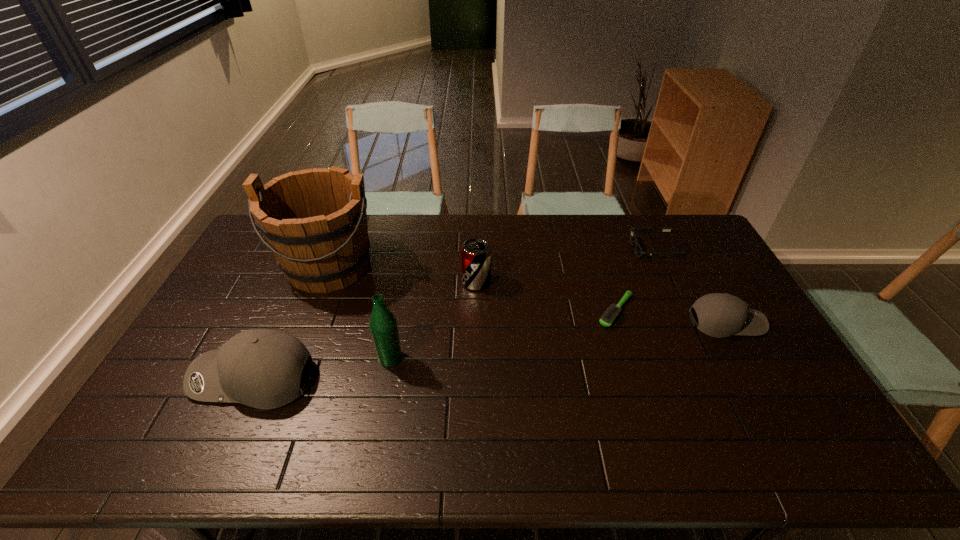
Locate an element on the screen. The image size is (960, 540). free point at the left edge is located at coordinates (217, 321).

Find the location of `free point at the right edge`. free point at the right edge is located at coordinates (722, 284).

Where is `free spot between the soda can and the tallest object`? Image resolution: width=960 pixels, height=540 pixels. free spot between the soda can and the tallest object is located at coordinates (403, 274).

You are a GUI agent. You are given a task and a screenshot of the screen. Output one action in this format:
    pyautogui.click(x=<x>, y=<y>)
    Task: Click on the unoccupied position between the fourth object from right to left and the shortest object
    
    Given the screenshot: What is the action you would take?
    pyautogui.click(x=546, y=296)

Locate an element on the screen. Image resolution: width=960 pixels, height=540 pixels. vacant point located between the right baseball cap and the wine bucket is located at coordinates (528, 293).

In order to click on unoccupied position between the sunglasses and the soda can in this screenshot , I will do pyautogui.click(x=565, y=266).

Locate an element on the screen. This screenshot has width=960, height=540. free area in between the shorter baseball cap and the third object from left to right is located at coordinates (558, 340).

Where is `free space that is in between the right baseball cap and the left baseball cap`? The height and width of the screenshot is (540, 960). free space that is in between the right baseball cap and the left baseball cap is located at coordinates tap(490, 350).

Identify the location of vacant point located between the second shortest object and the bottle. This screenshot has width=960, height=540. (522, 303).

This screenshot has height=540, width=960. I want to click on free space between the right baseball cap and the third object from left to right, so click(558, 340).